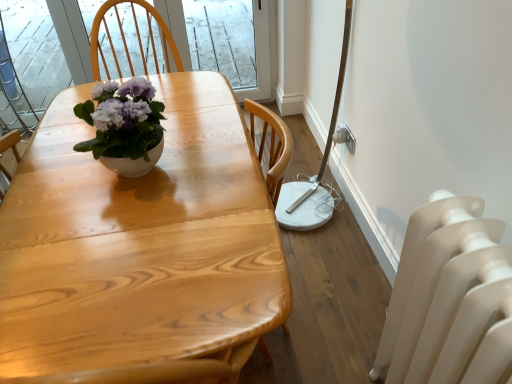
Question: From the image's perspective, is white matte radiator at lower right below white glossy pot at center?

Choices:
 (A) yes
 (B) no

Answer: (A)

Question: Is white matte radiator at lower right far from white glossy pot at center?

Choices:
 (A) no
 (B) yes

Answer: (A)

Question: Is white matte radiator at lower right looking in the opposite direction of white glossy pot at center?

Choices:
 (A) no
 (B) yes

Answer: (A)

Question: Does white matte radiator at lower right touch white glossy pot at center?

Choices:
 (A) no
 (B) yes

Answer: (A)

Question: Does white matte radiator at lower right lie behind white glossy pot at center?

Choices:
 (A) no
 (B) yes

Answer: (A)

Question: From a real-world perspective, is white matte radiator at lower right on top of white glossy pot at center?

Choices:
 (A) yes
 (B) no

Answer: (B)

Question: Is the position of white glossy pot at center less distant than that of natural wood table at center?

Choices:
 (A) no
 (B) yes

Answer: (A)

Question: Does white glossy pot at center have a lesser width compared to natural wood table at center?

Choices:
 (A) no
 (B) yes

Answer: (B)

Question: Is white glossy pot at center further to camera compared to natural wood table at center?

Choices:
 (A) no
 (B) yes

Answer: (B)

Question: Is white glossy pot at center bigger than natural wood table at center?

Choices:
 (A) yes
 (B) no

Answer: (B)

Question: Would you say white glossy pot at center is a long distance from natural wood table at center?

Choices:
 (A) no
 (B) yes

Answer: (A)

Question: From a real-world perspective, does white glossy pot at center sit lower than natural wood table at center?

Choices:
 (A) no
 (B) yes

Answer: (A)

Question: Is white matte radiator at lower right positioned with its back to natural wood table at center?

Choices:
 (A) no
 (B) yes

Answer: (A)